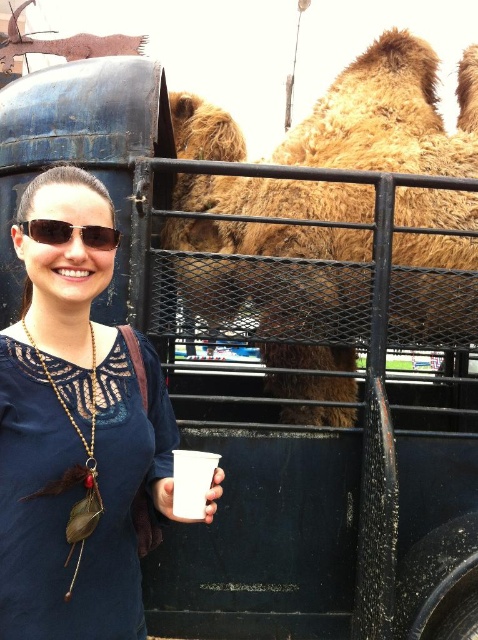
Which of these two, fuzzy brown camel at upper right or white paper cup at lower left, stands shorter?

With less height is white paper cup at lower left.

What do you see at coordinates (389, 115) in the screenshot? This screenshot has height=640, width=478. I see `fuzzy brown camel at upper right` at bounding box center [389, 115].

At what (x,y) coordinates should I click in order to perform the action: click on fuzzy brown camel at upper right. Please return your answer as a coordinate pair (x, y). Looking at the image, I should click on (389, 115).

Is point (251, 278) closer to camera compared to point (65, 240)?

No, it is behind (65, 240).

Does fuzzy brown camel at upper right have a greater height compared to matte black sunglasses at center?

Yes, fuzzy brown camel at upper right is taller than matte black sunglasses at center.

Identify the location of fuzzy brown camel at upper right. This screenshot has width=478, height=640. (389, 115).

Where is `fuzzy brown camel at upper right`? fuzzy brown camel at upper right is located at coordinates (389, 115).

Is blue fabric shirt at center closer to camera compared to matte black sunglasses at center?

Yes, it is.

From the picture: Which of these two, blue fabric shirt at center or matte black sunglasses at center, stands shorter?

matte black sunglasses at center is shorter.

Is point (120, 502) behind point (26, 220)?

Yes, it is.

Locate an element on the screen. The width and height of the screenshot is (478, 640). blue fabric shirt at center is located at coordinates (75, 435).